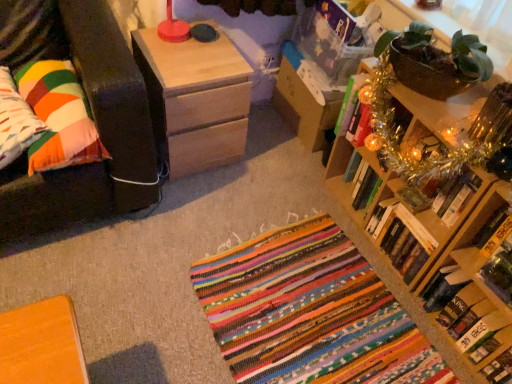
The width and height of the screenshot is (512, 384). Find the location of `empty space that is ontop of natural wood nightstand at upper left (from a real-world perspective)`. empty space that is ontop of natural wood nightstand at upper left (from a real-world perspective) is located at coordinates (186, 47).